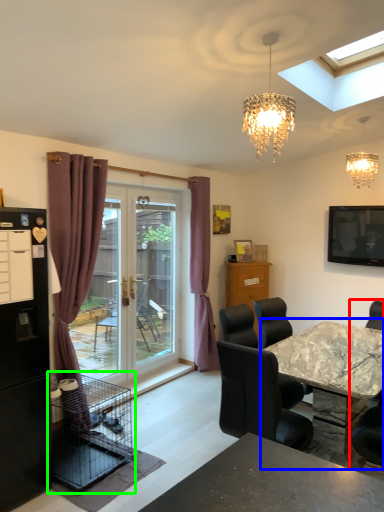
Question: Estimate the real-world distances between objects in this image. Which object is closer to chair (highlighted by a red box), kitchen & dining room table (highlighted by a blue box) or bird cage (highlighted by a green box)?

Choices:
 (A) kitchen & dining room table
 (B) bird cage

Answer: (A)